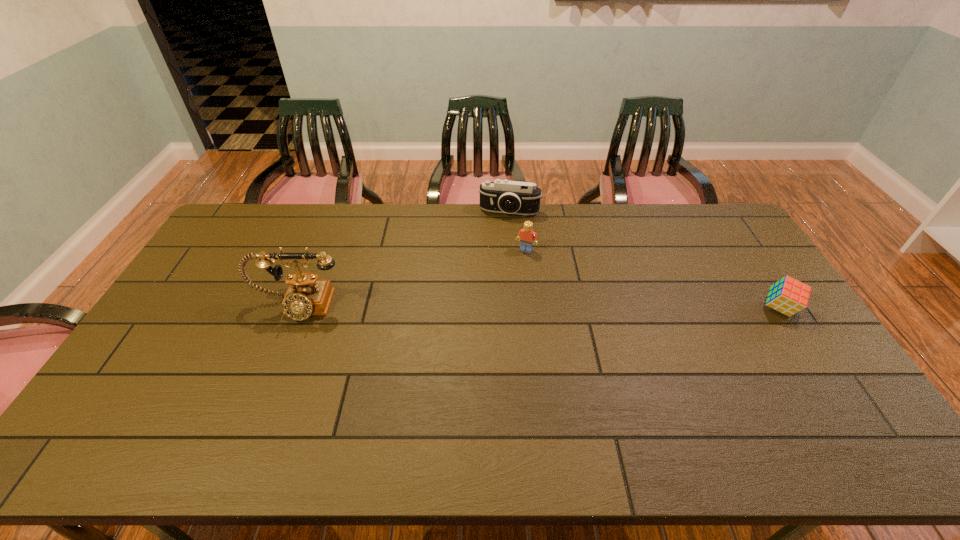
In the image, there is a desktop. Identify the location of vacant area at the far right corner. (724, 222).

You are a GUI agent. You are given a task and a screenshot of the screen. Output one action in this format:
    pyautogui.click(x=<x>, y=<y>)
    Task: Click on the blank space at the near right corner
    
    Given the screenshot: What is the action you would take?
    pyautogui.click(x=850, y=411)

The image size is (960, 540). I want to click on vacant space that's between the camera and the cube, so click(645, 260).

This screenshot has width=960, height=540. I want to click on free space between the telephone and the cube, so pos(539,307).

The width and height of the screenshot is (960, 540). In order to click on free point between the cube and the farthest object in this screenshot , I will do `click(645, 260)`.

At what (x,y) coordinates should I click in order to perform the action: click on vacant area between the farthest object and the Lego. Please return your answer as a coordinate pair (x, y). Looking at the image, I should click on (517, 231).

Image resolution: width=960 pixels, height=540 pixels. What are the coordinates of `empty location between the telephone and the third nearest object` in the screenshot? It's located at (412, 278).

At what (x,y) coordinates should I click in order to perform the action: click on vacant area that lies between the second farthest object and the farthest object. Please return your answer as a coordinate pair (x, y). This screenshot has width=960, height=540. Looking at the image, I should click on (517, 231).

Find the location of a particular element. Image resolution: width=960 pixels, height=540 pixels. vacant space that's between the rightmost object and the telephone is located at coordinates (539, 307).

Locate an element on the screen. vacant space that is in between the third nearest object and the leftmost object is located at coordinates (412, 278).